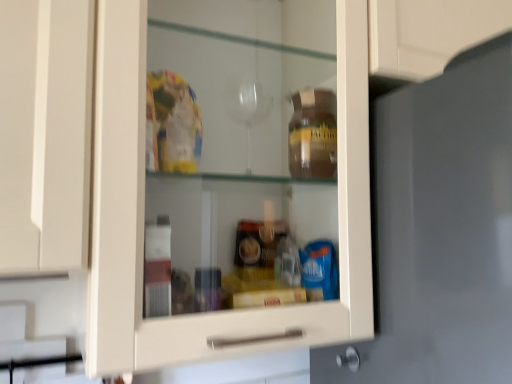
Question: From the image's perspective, is matte gray door at center on metallic silver knob at lower right?

Choices:
 (A) yes
 (B) no

Answer: (A)

Question: Is matte gray door at center with metallic silver knob at lower right?

Choices:
 (A) yes
 (B) no

Answer: (B)

Question: Does matte gray door at center have a smaller size compared to metallic silver knob at lower right?

Choices:
 (A) yes
 (B) no

Answer: (B)

Question: Is matte gray door at center to the left of metallic silver knob at lower right from the viewer's perspective?

Choices:
 (A) no
 (B) yes

Answer: (A)

Question: Is matte gray door at center surrounding metallic silver knob at lower right?

Choices:
 (A) yes
 (B) no

Answer: (A)

Question: Could you tell me if matte gray door at center is facing metallic silver knob at lower right?

Choices:
 (A) yes
 (B) no

Answer: (B)

Question: Does metallic silver knob at lower right appear on the left side of matte gray door at center?

Choices:
 (A) yes
 (B) no

Answer: (A)

Question: Are metallic silver knob at lower right and matte gray door at center located far from each other?

Choices:
 (A) yes
 (B) no

Answer: (B)

Question: Is metallic silver knob at lower right smaller than matte gray door at center?

Choices:
 (A) yes
 (B) no

Answer: (A)

Question: Does metallic silver knob at lower right come behind matte gray door at center?

Choices:
 (A) yes
 (B) no

Answer: (A)

Question: Is metallic silver knob at lower right placed right next to matte gray door at center?

Choices:
 (A) no
 (B) yes

Answer: (A)

Question: Is matte gray door at center at the back of metallic silver knob at lower right?

Choices:
 (A) no
 (B) yes

Answer: (B)

Question: Is matte gray door at center bigger or smaller than metallic silver knob at lower right?

Choices:
 (A) small
 (B) big

Answer: (B)